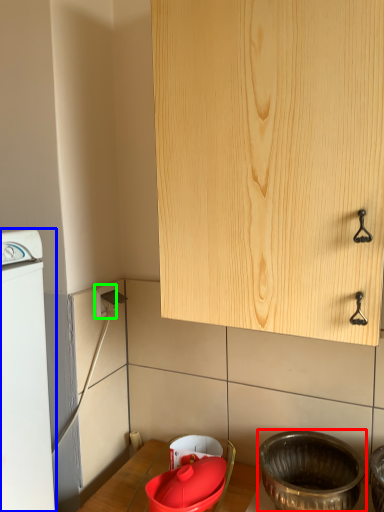
Question: Estimate the real-world distances between objects in this image. Which object is farther from basin (highlighted by a red box), home appliance (highlighted by a blue box) or electric outlet (highlighted by a green box)?

Choices:
 (A) home appliance
 (B) electric outlet

Answer: (B)